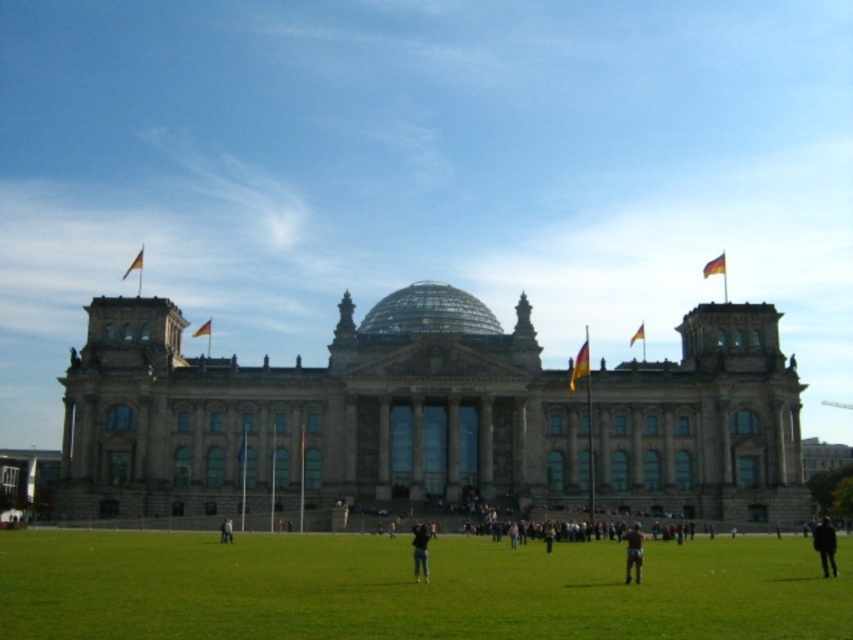
Question: Which point is closer to the camera?

Choices:
 (A) yellow fabric flag at center
 (B) dark brown leather jacket at lower center
 (C) yellow-green fabric flag at center-right

Answer: (B)

Question: Is black fabric person at center bigger than yellow-green fabric flag at upper right?

Choices:
 (A) no
 (B) yes

Answer: (B)

Question: Does black fabric person at center have a smaller size compared to yellow fabric flag at upper left?

Choices:
 (A) no
 (B) yes

Answer: (A)

Question: Among these objects, which one is farthest from the camera?

Choices:
 (A) light gray fabric pants at lower center
 (B) dark brown leather jacket at lower center
 (C) yellow fabric flag at upper left

Answer: (C)

Question: Which point is farther to the camera?

Choices:
 (A) brown stone building at center
 (B) dark gray pants at lower right

Answer: (A)

Question: Can you confirm if dark gray pants at lower right is positioned below yellow fabric flag at upper left?

Choices:
 (A) yes
 (B) no

Answer: (A)